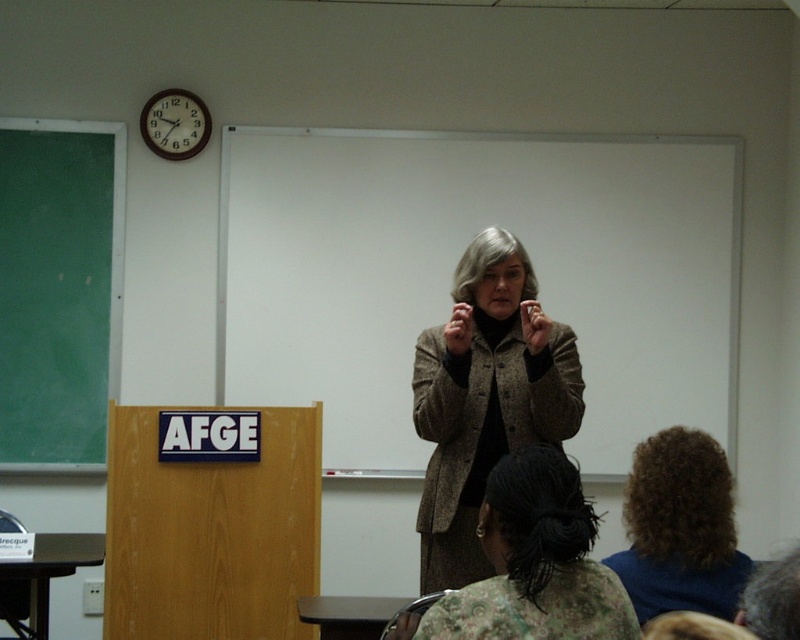
Can you confirm if white matte board at center is positioned above wooden clock at upper left?

No.

Which is above, white matte board at center or wooden clock at upper left?

wooden clock at upper left is higher up.

What do you see at coordinates (456, 262) in the screenshot? I see `white matte board at center` at bounding box center [456, 262].

At what (x,y) coordinates should I click in order to perform the action: click on white matte board at center. Please return your answer as a coordinate pair (x, y). Image resolution: width=800 pixels, height=640 pixels. Looking at the image, I should click on (456, 262).

Is brown woolen coat at center thinner than wooden clock at upper left?

In fact, brown woolen coat at center might be wider than wooden clock at upper left.

Can you confirm if brown woolen coat at center is wider than wooden clock at upper left?

Yes, brown woolen coat at center is wider than wooden clock at upper left.

Is point (562, 368) positioned before point (164, 108)?

Yes, point (562, 368) is closer to viewer.

The width and height of the screenshot is (800, 640). What are the coordinates of `brown woolen coat at center` in the screenshot? It's located at (486, 397).

Which is below, white matte board at center or curly brown hair at lower right?

curly brown hair at lower right is lower down.

Between white matte board at center and curly brown hair at lower right, which one has less height?

curly brown hair at lower right is shorter.

Is point (254, 308) closer to camera compared to point (616, 556)?

No, it is behind (616, 556).

Locate an element on the screen. The height and width of the screenshot is (640, 800). white matte board at center is located at coordinates (456, 262).